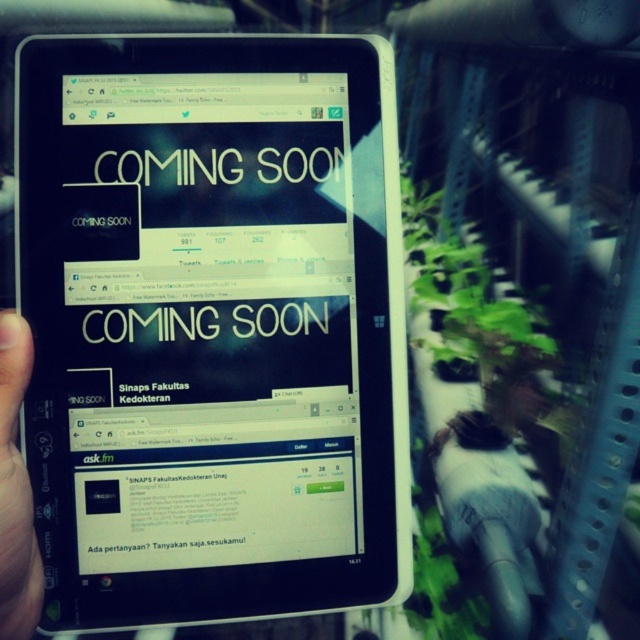
Who is positioned more to the left, black glossy tablet at center or black matte tablet at left?

black matte tablet at left is more to the left.

Which is above, black glossy tablet at center or black matte tablet at left?

black glossy tablet at center

Between point (60, 276) and point (35, 596), which one is positioned behind?

The point (60, 276) is behind.

Where is `black glossy tablet at center`? black glossy tablet at center is located at coordinates (212, 324).